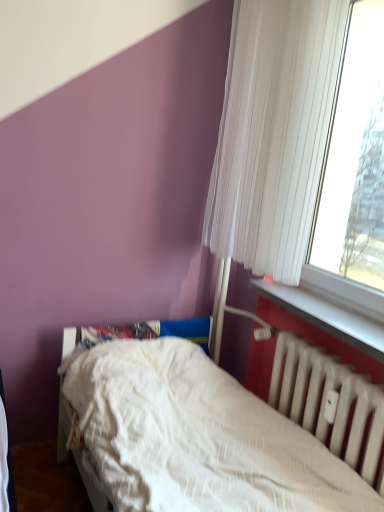
Question: From a real-world perspective, is white plastic window sill at lower right physically located above or below white textured bed at lower center?

Choices:
 (A) below
 (B) above

Answer: (B)

Question: Based on their sizes in the image, would you say white plastic window sill at lower right is bigger or smaller than white textured bed at lower center?

Choices:
 (A) big
 (B) small

Answer: (B)

Question: Estimate the real-world distances between objects in this image. Which object is farther from the white textured bed at lower center?

Choices:
 (A) white pleated curtain at upper right
 (B) white matte radiator at lower right
 (C) white plastic window sill at lower right

Answer: (A)

Question: Which of these objects is positioned farthest from the white pleated curtain at upper right?

Choices:
 (A) white plastic window sill at lower right
 (B) white matte radiator at lower right
 (C) white textured bed at lower center

Answer: (C)